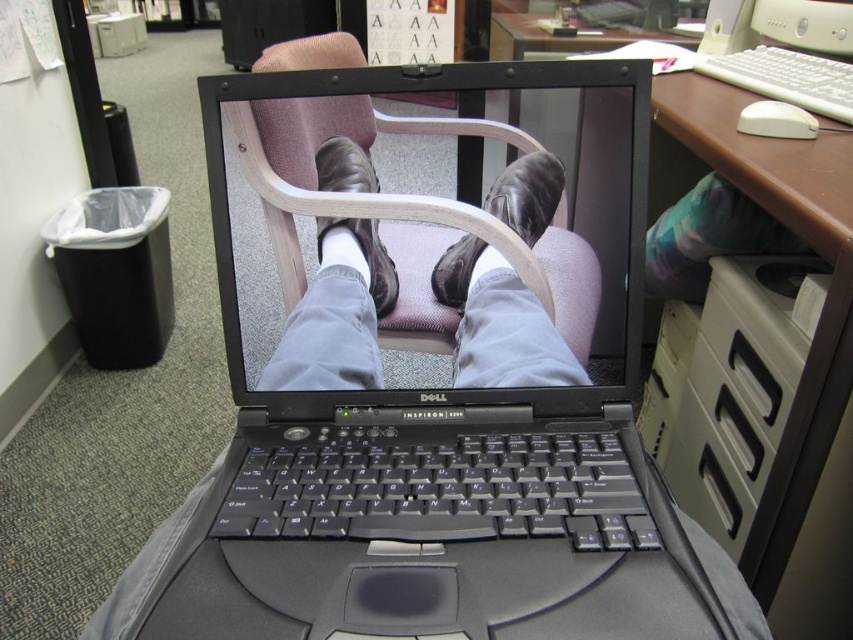
You are a delivery robot trying to navigate to a specific location in the office. You need to move from point A to point B. Point A is at coordinate point(x=550, y=156) and point B is at coordinate point(x=387, y=273). Which point is closer to you when you start at point A?

Point A is closer to the viewer than point B, so when you start at point A, point A is closer to you.

You are an office inspector checking for proper equipment usage. You see the leather at center and the brown leather shoe at center. Which object is shorter in height?

The leather at center is shorter than the brown leather shoe at center.

You are an office security camera monitoring the scene. You notice the black matte laptop at center and the brown leather shoe at center. Which object is closer to you?

The black matte laptop at center is closer to the viewer than the brown leather shoe at center.